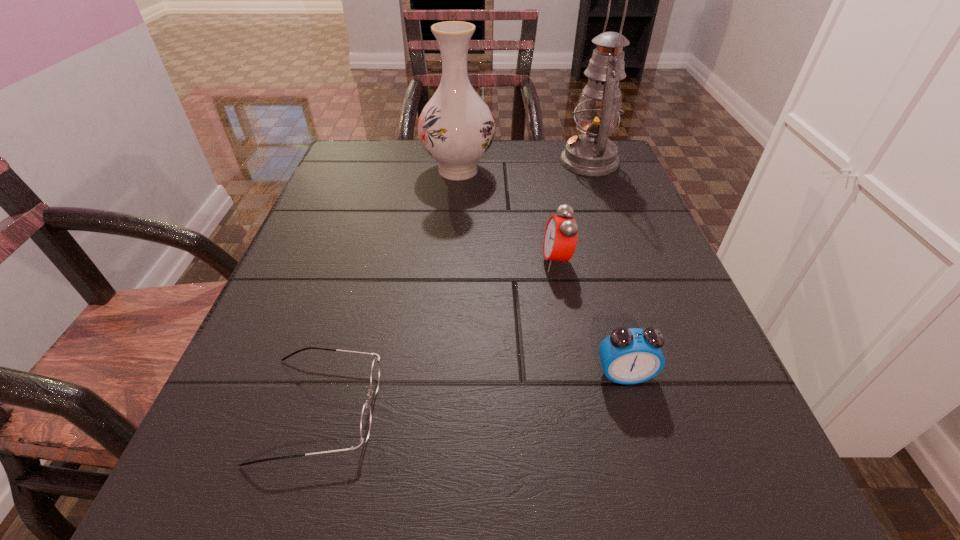
The height and width of the screenshot is (540, 960). What are the coordinates of `oil lamp` in the screenshot? It's located at (592, 153).

Locate an element on the screen. the fourth shortest object is located at coordinates (456, 127).

You are a GUI agent. You are given a task and a screenshot of the screen. Output one action in this format:
    pyautogui.click(x=<x>, y=<y>)
    Task: Click on the third nearest object
    
    Given the screenshot: What is the action you would take?
    pyautogui.click(x=560, y=239)

Where is `the second shortest object`? The width and height of the screenshot is (960, 540). the second shortest object is located at coordinates (628, 356).

Where is `the shorter alarm clock`? The width and height of the screenshot is (960, 540). the shorter alarm clock is located at coordinates (628, 356).

You are a GUI agent. You are given a task and a screenshot of the screen. Output one action in this format:
    pyautogui.click(x=<x>, y=<y>)
    Task: Click on the shortest object
    The height and width of the screenshot is (540, 960).
    Given the screenshot: What is the action you would take?
    pyautogui.click(x=365, y=424)

This screenshot has height=540, width=960. I want to click on vacant point located on the left of the oil lamp, so click(x=432, y=162).

Where is `vacant space situated on the front of the fourth shortest object`? vacant space situated on the front of the fourth shortest object is located at coordinates (455, 222).

The height and width of the screenshot is (540, 960). I want to click on free space located on the front-facing side of the farther alarm clock, so click(x=399, y=261).

I want to click on vacant region located on the front-facing side of the farther alarm clock, so click(498, 261).